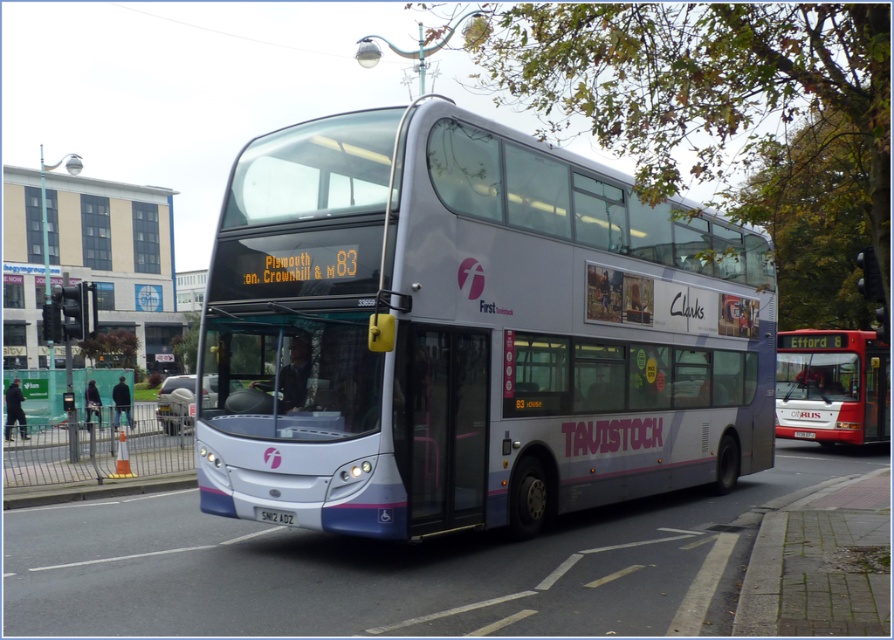
You are a delivery person who needs to park your 2.5 meter wide van next to the silver metallic bus at center and the white plastic license plate at center. Given that the road is only 5 meters wide, will there be enough space for your van if you park it alongside the bus?

The silver metallic bus at center is wider than the white plastic license plate at center. Since the bus is wider than the license plate, and the road is 5 meters wide, there might not be enough space for the van. However, without knowing the exact width of the bus, it is impossible to determine precisely.

From the picture: You are standing at the back of the double decker bus and want to walk to the pink circular logo near the front. There are two points marked on the road in front of the bus. Which point, point (580, 493) or point (835, 330), is closer to the pink circular logo?

Point (580, 493) is in front of point (835, 330), so it is closer to the pink circular logo near the front of the bus.

You are a pedestrian standing on the sidewalk next to the silver metallic bus at center and the white plastic license plate at center. Which object is closer to the ground?

The white plastic license plate at center is closer to the ground because the silver metallic bus at center is located above it.